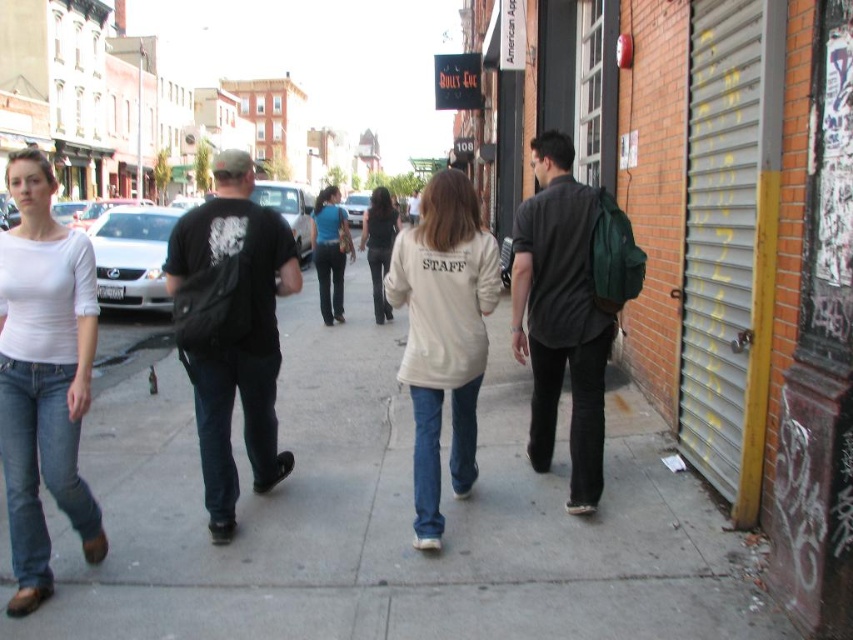
Between point (32, 426) and point (540, 141), which one is positioned behind?

Positioned behind is point (540, 141).

Between point (49, 432) and point (572, 236), which one is positioned in front?

Point (49, 432) is in front.

Who is more distant from viewer, [50,310] or [543,346]?

The point [543,346] is more distant.

You are a GUI agent. You are given a task and a screenshot of the screen. Output one action in this format:
    pyautogui.click(x=<x>, y=<y>)
    Task: Click on the matte white shirt at center
    This screenshot has width=853, height=640.
    Given the screenshot: What is the action you would take?
    pyautogui.click(x=44, y=376)

Between point (225, 195) and point (323, 198), which one is positioned in front?

Positioned in front is point (225, 195).

Does black matte backpack at center appear under denim pants at center?

Indeed, black matte backpack at center is positioned under denim pants at center.

Is point (209, 419) positioned behind point (318, 230)?

No, (209, 419) is in front of (318, 230).

The image size is (853, 640). I want to click on black matte backpack at center, so (231, 328).

Is point (585, 330) positioned behind point (381, 209)?

No, it is in front of (381, 209).

Is dark gray shirt at right smaller than dark gray jeans at center?

Yes, dark gray shirt at right is smaller than dark gray jeans at center.

Locate an element on the screen. This screenshot has height=640, width=853. dark gray shirt at right is located at coordinates (560, 316).

Locate an element on the screen. This screenshot has height=640, width=853. dark gray shirt at right is located at coordinates (560, 316).